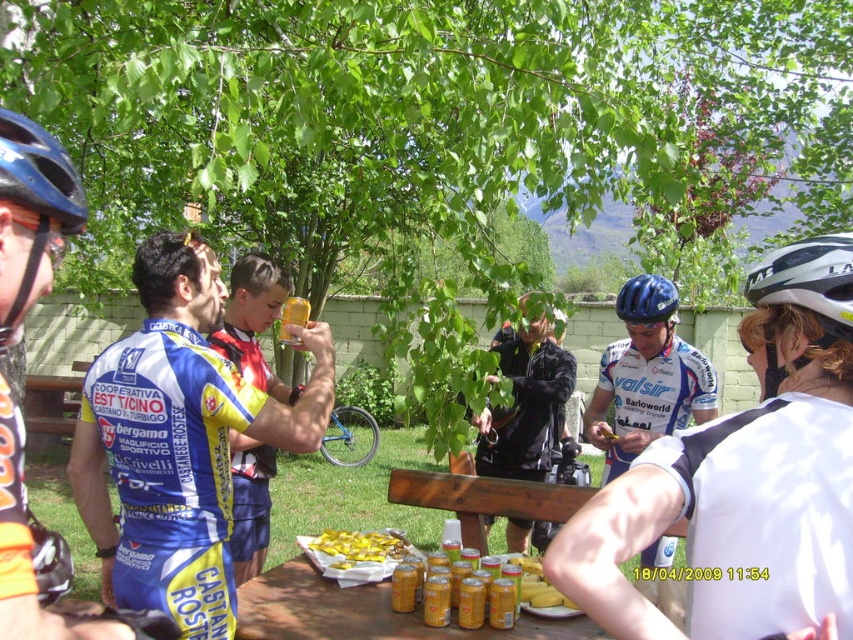
Can you confirm if shiny blue helmet at left is wider than blue matte helmet at center?

No, shiny blue helmet at left is not wider than blue matte helmet at center.

Is shiny blue helmet at left smaller than blue matte helmet at center?

Yes.

Identify the location of shiny blue helmet at left. (39, 173).

Which of these two, blue jersey at center or black leather jacket at center, stands shorter?

Standing shorter between the two is black leather jacket at center.

Is blue jersey at center thinner than black leather jacket at center?

In fact, blue jersey at center might be wider than black leather jacket at center.

The image size is (853, 640). Find the location of `blue jersey at center`. blue jersey at center is located at coordinates tap(178, 442).

Where is `blue jersey at center`? This screenshot has height=640, width=853. blue jersey at center is located at coordinates (178, 442).

Between blue jersey at left and white matte bicycle helmet at upper right, which one has more height?

With more height is blue jersey at left.

Between point (26, 240) and point (749, 278), which one is positioned behind?

Point (749, 278)

Does point (55, 204) lie behind point (796, 256)?

No.

The width and height of the screenshot is (853, 640). What are the coordinates of `blue jersey at left` in the screenshot? It's located at (32, 216).